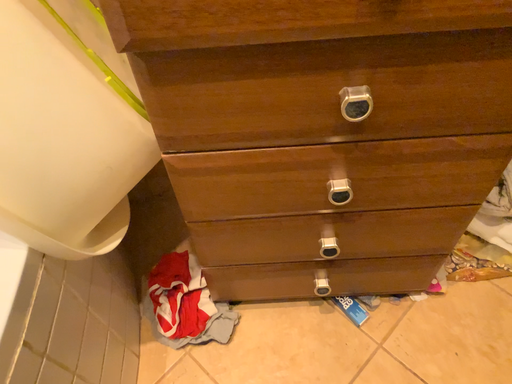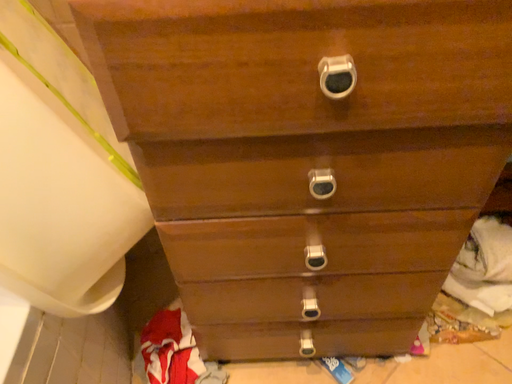
Question: Which way did the camera rotate in the video?

Choices:
 (A) rotated downward
 (B) rotated upward

Answer: (B)